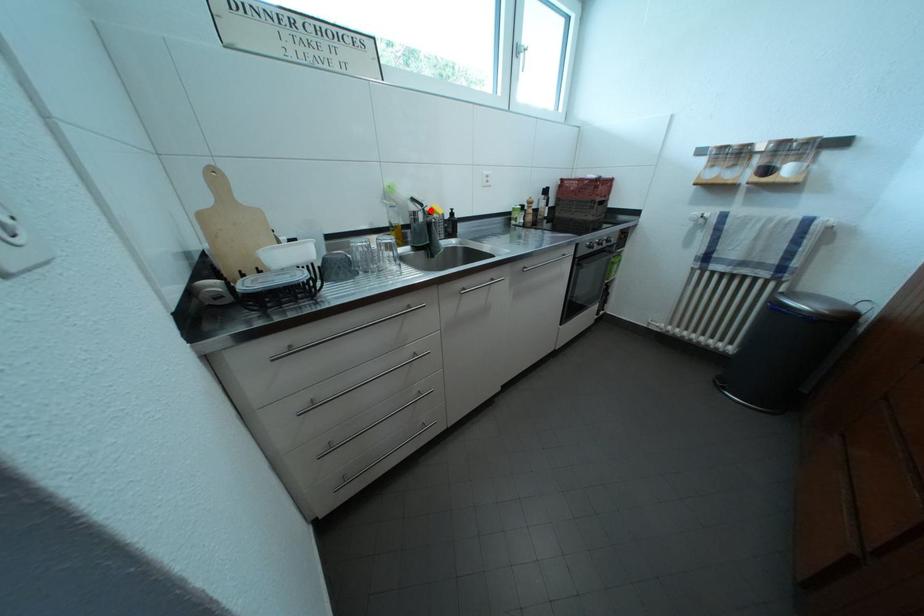
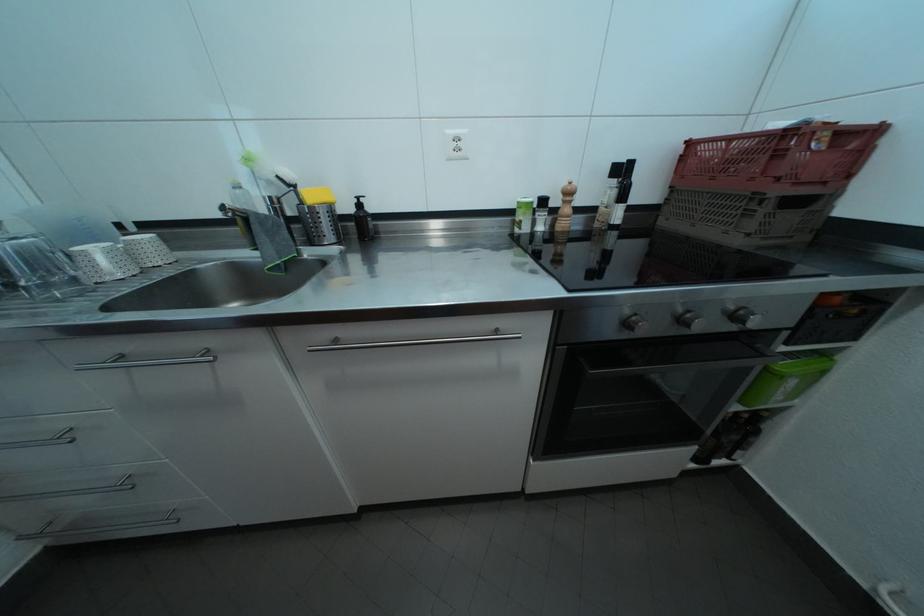
Where in the second image is the point corresponding to the highlighted location from the first image?

(304, 192)